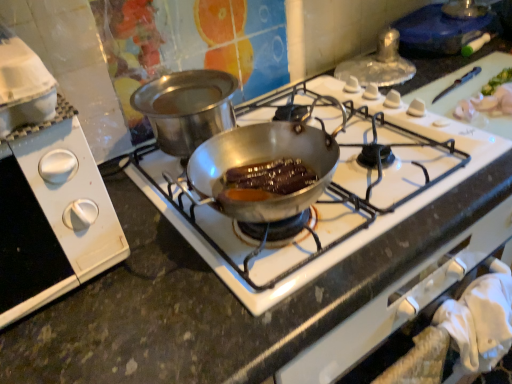
What do you see at coordinates (310, 234) in the screenshot? I see `shiny silver pan at center` at bounding box center [310, 234].

This screenshot has height=384, width=512. Find the location of `shiny silver pan at center`. shiny silver pan at center is located at coordinates (310, 234).

Measure the distance between point (265, 303) and camera.

Point (265, 303) and camera are 21.69 inches apart.

Locate an element on the screen. white plastic stove knobs at left is located at coordinates (52, 220).

What do you see at coordinates (52, 220) in the screenshot? I see `white plastic stove knobs at left` at bounding box center [52, 220].

The width and height of the screenshot is (512, 384). I want to click on shiny silver pan at center, so click(310, 234).

Which object is positioned more to the left, shiny silver pan at center or white plastic stove knobs at left?

white plastic stove knobs at left.

Is the position of shiny silver pan at center more distant than that of white plastic stove knobs at left?

That is True.

Which is closer to the camera, [293,284] or [14,215]?

Point [293,284] appears to be farther away from the viewer than point [14,215].

From the image's perspective, which is below, shiny silver pan at center or white plastic stove knobs at left?

white plastic stove knobs at left appears lower in the image.

From a real-world perspective, is shiny silver pan at center under white plastic stove knobs at left?

Yes, from a real-world perspective, shiny silver pan at center is under white plastic stove knobs at left.

Can you confirm if shiny silver pan at center is wider than white plastic stove knobs at left?

Yes, shiny silver pan at center is wider than white plastic stove knobs at left.

Considering the relative sizes of shiny silver pan at center and white plastic stove knobs at left in the image provided, is shiny silver pan at center taller than white plastic stove knobs at left?

No, shiny silver pan at center is not taller than white plastic stove knobs at left.

Considering the sizes of objects shiny silver pan at center and white plastic stove knobs at left in the image provided, who is smaller, shiny silver pan at center or white plastic stove knobs at left?

white plastic stove knobs at left is smaller.

Is shiny silver pan at center surrounding white plastic stove knobs at left?

No, shiny silver pan at center does not contain white plastic stove knobs at left.

Is shiny silver pan at center directly adjacent to white plastic stove knobs at left?

shiny silver pan at center and white plastic stove knobs at left are clearly separated.

Does shiny silver pan at center turn towards white plastic stove knobs at left?

No, shiny silver pan at center does not turn towards white plastic stove knobs at left.

How many degrees apart are the facing directions of shiny silver pan at center and white plastic stove knobs at left?

The angle between the facing direction of shiny silver pan at center and the facing direction of white plastic stove knobs at left is 3.06 degrees.

The height and width of the screenshot is (384, 512). I want to click on gas stove behind the white plastic stove knobs at left, so click(x=310, y=234).

In the image, is white plastic stove knobs at left on the left side or the right side of shiny silver pan at center?

Clearly, white plastic stove knobs at left is on the left of shiny silver pan at center in the image.

Which is in front, white plastic stove knobs at left or shiny silver pan at center?

white plastic stove knobs at left.

Does point (98, 267) appear closer or farther from the camera than point (281, 292)?

Point (98, 267) is positioned farther from the camera compared to point (281, 292).

From the image's perspective, between white plastic stove knobs at left and shiny silver pan at center, who is located below?

From the image's view, white plastic stove knobs at left is below.

From a real-world perspective, is white plastic stove knobs at left positioned under shiny silver pan at center based on gravity?

Actually, white plastic stove knobs at left is physically above shiny silver pan at center in the real world.

In terms of width, does white plastic stove knobs at left look wider or thinner when compared to shiny silver pan at center?

In the image, white plastic stove knobs at left appears to be more narrow than shiny silver pan at center.

Is white plastic stove knobs at left shorter than shiny silver pan at center?

Incorrect, the height of white plastic stove knobs at left does not fall short of that of shiny silver pan at center.

Is white plastic stove knobs at left bigger than shiny silver pan at center?

Actually, white plastic stove knobs at left might be smaller than shiny silver pan at center.

Would you say white plastic stove knobs at left is outside shiny silver pan at center?

white plastic stove knobs at left lies outside shiny silver pan at center's area.

Is there a large distance between white plastic stove knobs at left and shiny silver pan at center?

Actually, white plastic stove knobs at left and shiny silver pan at center are a little close together.

Is white plastic stove knobs at left facing towards shiny silver pan at center?

No, white plastic stove knobs at left is not turned towards shiny silver pan at center.

What's the angular difference between white plastic stove knobs at left and shiny silver pan at center's facing directions?

3.06 degrees.

Identify the location of gas stove on the right of the white plastic stove knobs at left. click(310, 234).

Find the location of a particular element. This screenshot has width=512, height=384. gas stove that appears above the white plastic stove knobs at left (from the image's perspective) is located at coordinates (310, 234).

Find the location of a particular element. The image size is (512, 384). gas stove behind the white plastic stove knobs at left is located at coordinates (310, 234).